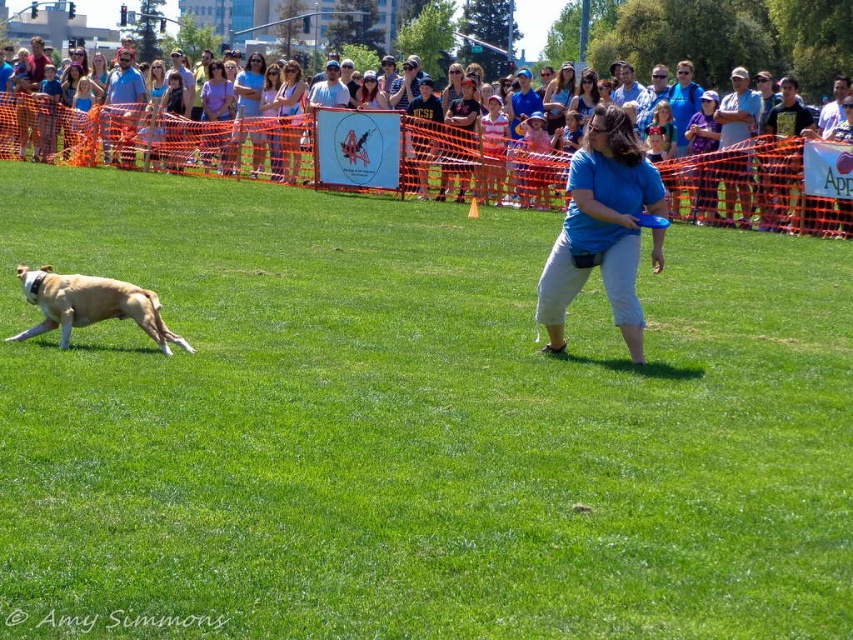
Does light blue shirt at upper center have a greater height compared to light blue shirt at center?

Indeed, light blue shirt at upper center has a greater height compared to light blue shirt at center.

Who is positioned more to the right, light blue shirt at upper center or light blue shirt at center?

light blue shirt at upper center

What do you see at coordinates (735, 138) in the screenshot? I see `light blue shirt at upper center` at bounding box center [735, 138].

The width and height of the screenshot is (853, 640). What are the coordinates of `light blue shirt at upper center` in the screenshot? It's located at (735, 138).

Which is above, light brown fur at left or light blue shirt at upper center?

light blue shirt at upper center is higher up.

Is light brown fur at left positioned in front of light blue shirt at upper center?

Yes, light brown fur at left is closer to the viewer.

What do you see at coordinates (90, 305) in the screenshot? I see `light brown fur at left` at bounding box center [90, 305].

Image resolution: width=853 pixels, height=640 pixels. Identify the location of light brown fur at left. (90, 305).

Based on the photo, who is positioned more to the right, light brown fur at left or matte blue shirt at center?

From the viewer's perspective, light brown fur at left appears more on the right side.

Which of these two, light brown fur at left or matte blue shirt at center, stands taller?

matte blue shirt at center is taller.

Where is `light brown fur at left`? This screenshot has width=853, height=640. light brown fur at left is located at coordinates (90, 305).